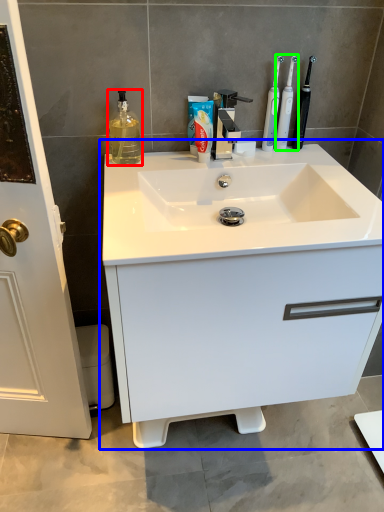
Question: Which object is the closest to the cleaning product (highlighted by a red box)? Choose among these: bathroom cabinet (highlighted by a blue box) or toothbrush (highlighted by a green box).

Choices:
 (A) bathroom cabinet
 (B) toothbrush

Answer: (B)